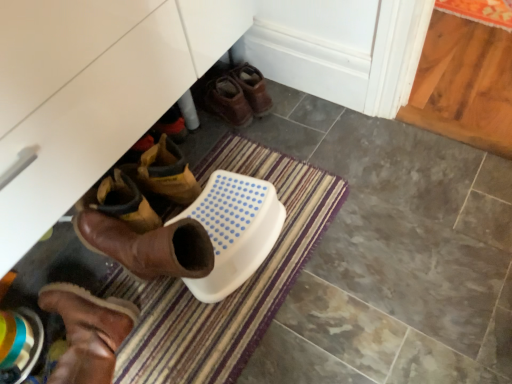
In order to click on free location above striped carpet at lower center (from a real-world perspective) in this screenshot , I will do `click(197, 302)`.